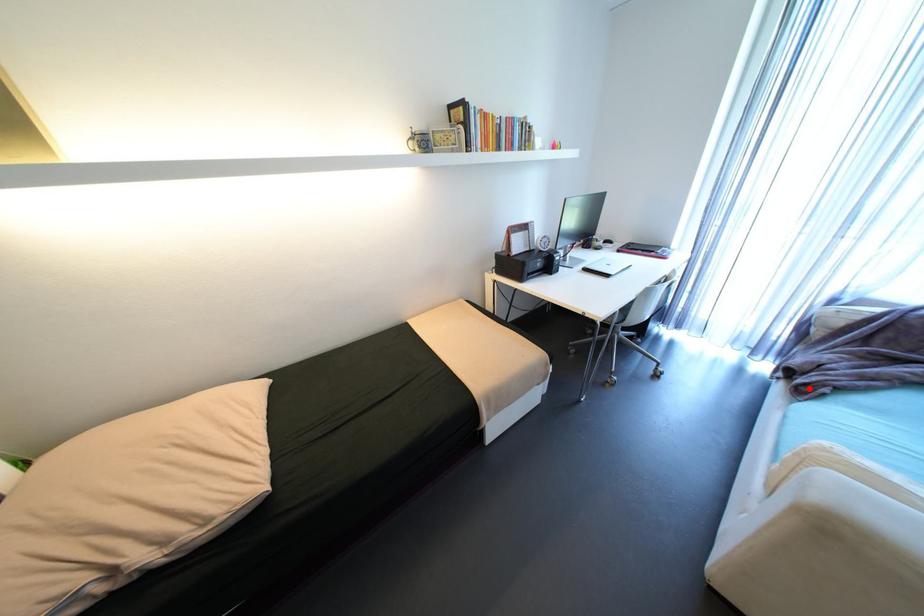
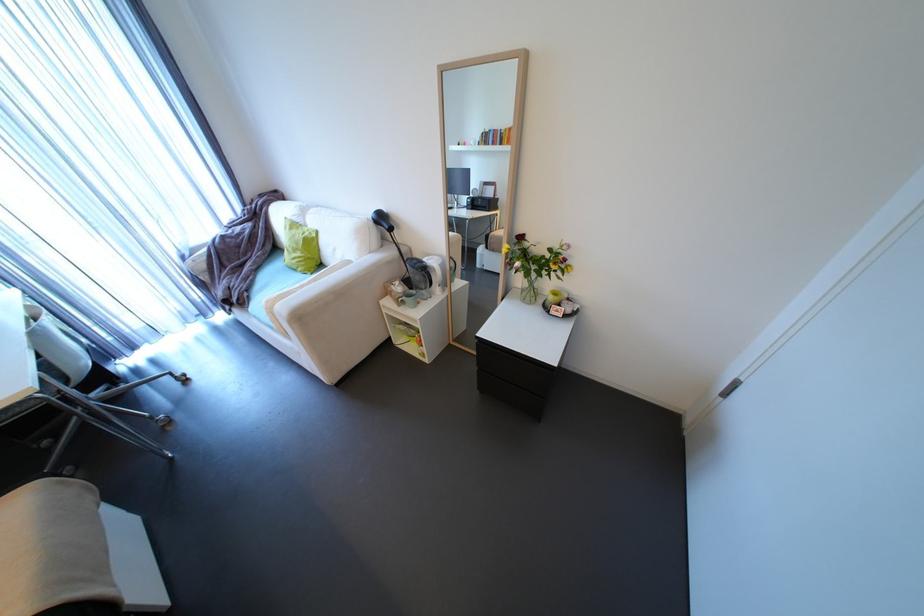
Locate, in the second image, the point that corresponds to the highlighted location in the first image.

(248, 302)